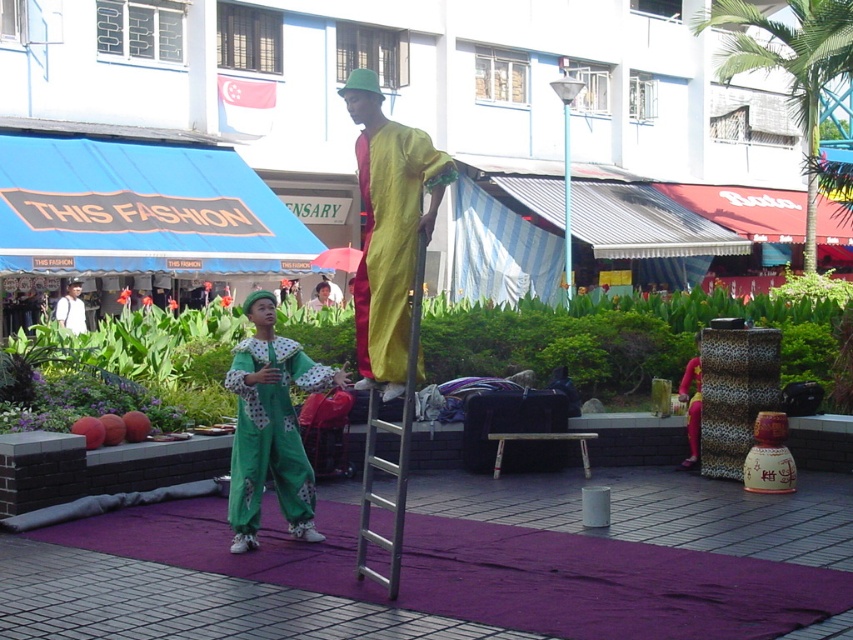
Question: Which point is closer to the camera?

Choices:
 (A) (74, 324)
 (B) (193, 216)
 (C) (691, 376)

Answer: (C)

Question: Estimate the real-world distances between objects in this image. Which object is closer to the white fabric shirt at left?

Choices:
 (A) pink leopard print robe at center
 (B) green fabric clown at center

Answer: (B)

Question: Is shiny yellow fabric at center above matte green jumpsuit at center?

Choices:
 (A) no
 (B) yes

Answer: (B)

Question: Which point appears farthest from the camera in this image?

Choices:
 (A) (326, 292)
 (B) (329, 282)
 (C) (59, 301)
 (D) (370, 499)

Answer: (B)

Question: Is blue fabric canopy at upper left wider than green fabric clown at center?

Choices:
 (A) yes
 (B) no

Answer: (A)

Question: Is white fabric shirt at left bigger than matte green jumpsuit at center?

Choices:
 (A) no
 (B) yes

Answer: (B)